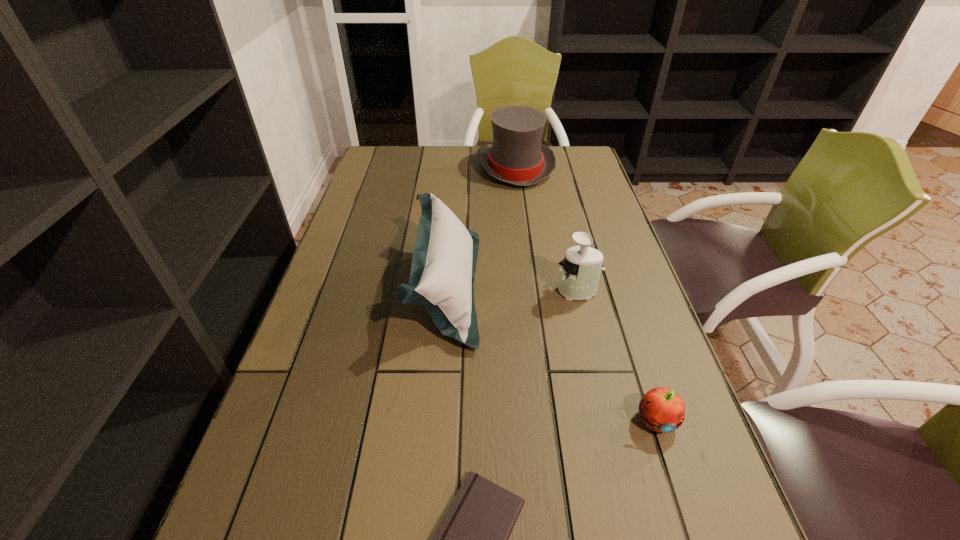
Where is `vacant space that is in between the juicer and the apple`? The height and width of the screenshot is (540, 960). vacant space that is in between the juicer and the apple is located at coordinates (616, 356).

Identify the location of free space that is in between the cushion and the dress hat. The image size is (960, 540). (481, 227).

Identify the location of vacant space that's between the juicer and the dress hat. click(x=546, y=229).

Where is `the fourth closest object to the farthest object`? the fourth closest object to the farthest object is located at coordinates (472, 539).

The width and height of the screenshot is (960, 540). What are the coordinates of `the closest object to the fourth farthest object` in the screenshot? It's located at (472, 539).

Where is `vacant space that satisfies the following two spatial constraints: 1. on the surface of the juicer; 2. on the right side of the cushion`? vacant space that satisfies the following two spatial constraints: 1. on the surface of the juicer; 2. on the right side of the cushion is located at coordinates (445, 292).

I want to click on free point that satisfies the following two spatial constraints: 1. on the back side of the juicer; 2. on the surface of the cushion, so click(576, 287).

Locate an element on the screen. This screenshot has height=540, width=960. vacant space that satisfies the following two spatial constraints: 1. on the surface of the cushion; 2. on the right side of the second nearest object is located at coordinates (435, 420).

Find the location of a particular element. The height and width of the screenshot is (540, 960). free space that satisfies the following two spatial constraints: 1. on the surface of the cushion; 2. on the back side of the juicer is located at coordinates (445, 292).

I want to click on vacant area that satisfies the following two spatial constraints: 1. on the surface of the cushion; 2. on the left side of the juicer, so click(x=445, y=292).